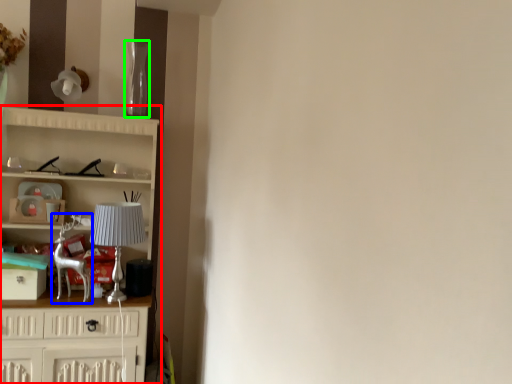
Question: Which object is the farthest from cupboard (highlighted by a red box)? Choose among these: swivel chair (highlighted by a blue box) or glass vase (highlighted by a green box).

Choices:
 (A) swivel chair
 (B) glass vase

Answer: (B)